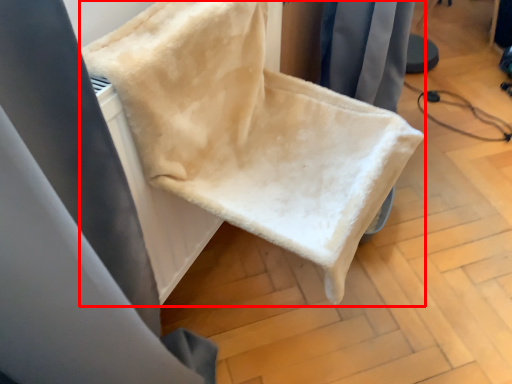
Question: From the image's perspective, where is furniture (annotated by the red box) located in relation to curtain in the image?

Choices:
 (A) above
 (B) below

Answer: (A)